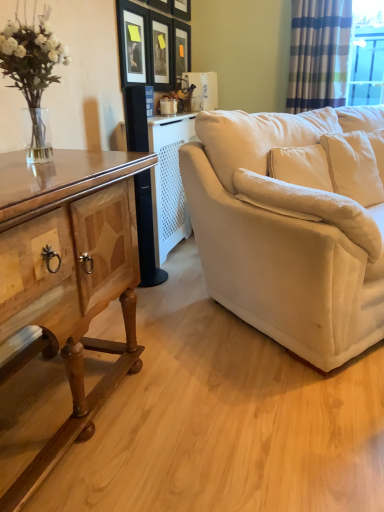
The height and width of the screenshot is (512, 384). I want to click on free area below wooden cabinet at left (from a real-world perspective), so click(x=38, y=409).